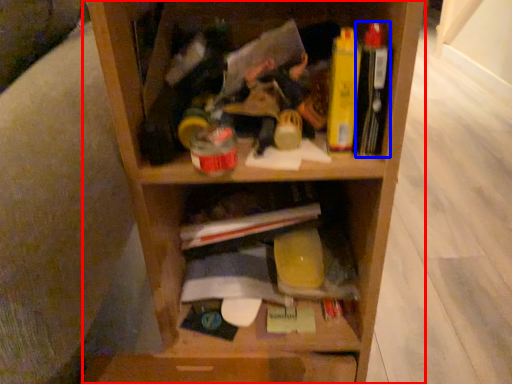
Question: Which object appears closest to the camera in this image, shelf (highlighted by a red box) or book (highlighted by a blue box)?

Choices:
 (A) shelf
 (B) book

Answer: (A)